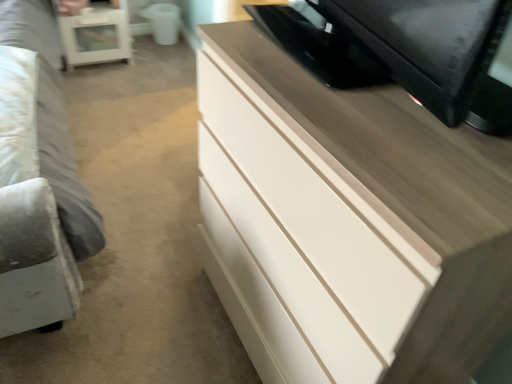
Question: Is white glossy side table at upper left bigger or smaller than white glossy chest of drawers at upper right?

Choices:
 (A) big
 (B) small

Answer: (B)

Question: Would you say white glossy side table at upper left is to the left or to the right of white glossy chest of drawers at upper right in the picture?

Choices:
 (A) right
 (B) left

Answer: (B)

Question: Considering the positions of point (80, 34) and point (334, 94), is point (80, 34) closer or farther from the camera than point (334, 94)?

Choices:
 (A) closer
 (B) farther

Answer: (B)

Question: Is white glossy chest of drawers at upper right spatially inside white glossy side table at upper left, or outside of it?

Choices:
 (A) outside
 (B) inside

Answer: (A)

Question: Visually, is white glossy chest of drawers at upper right positioned to the left or to the right of white glossy side table at upper left?

Choices:
 (A) right
 (B) left

Answer: (A)

Question: Based on their sizes in the image, would you say white glossy chest of drawers at upper right is bigger or smaller than white glossy side table at upper left?

Choices:
 (A) big
 (B) small

Answer: (A)

Question: Considering the positions of point (480, 162) and point (90, 13), is point (480, 162) closer or farther from the camera than point (90, 13)?

Choices:
 (A) closer
 (B) farther

Answer: (A)